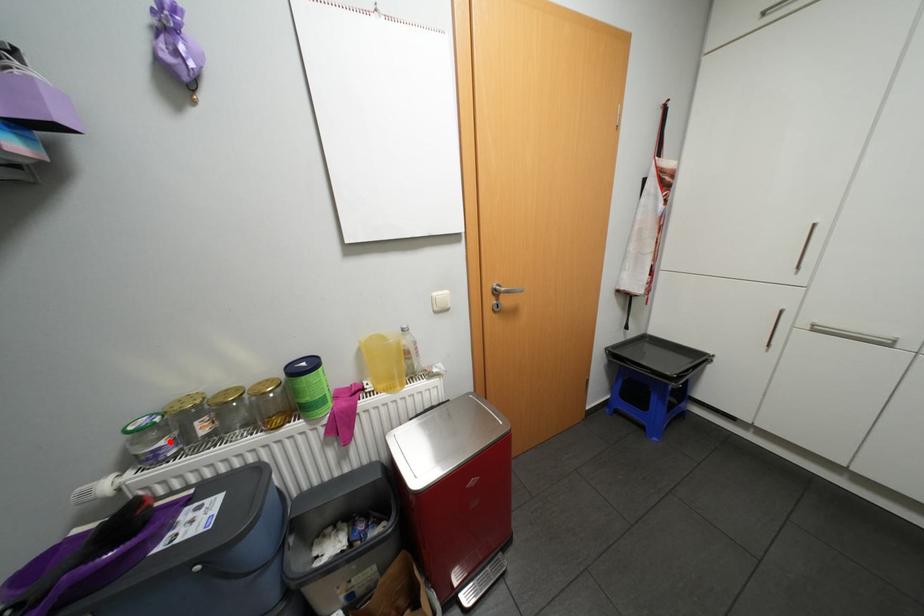
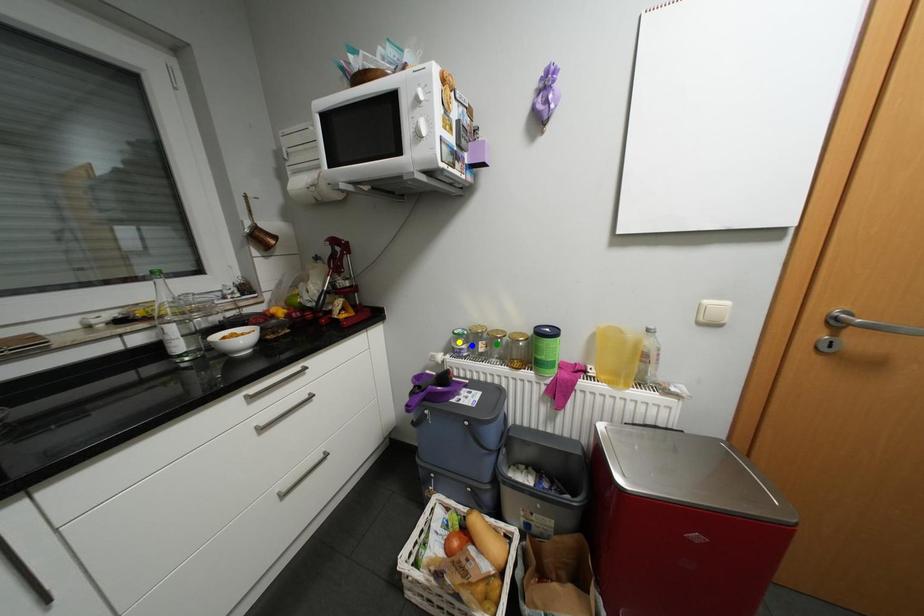
Question: I am providing you with two images of the same scene from different viewpoints. A red point is marked on the first image. You are given multiple points on the second image. Which point in image 2 represents the same 3d spot as the red point in image 1?

Choices:
 (A) yellow point
 (B) green point
 (C) blue point

Answer: (C)